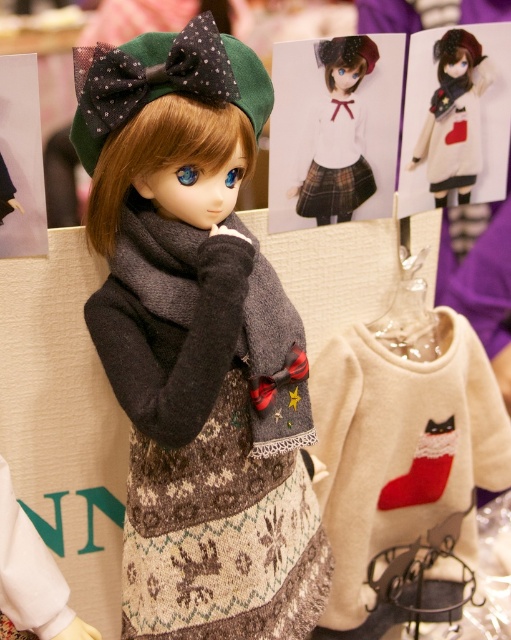
Question: Does matte white sweater at center appear on the right side of matte gray scarf at center?

Choices:
 (A) no
 (B) yes

Answer: (A)

Question: Does dark gray wool scarf at center appear over matte gray scarf at center?

Choices:
 (A) no
 (B) yes

Answer: (A)

Question: Which point is farther from the camera taking this photo?

Choices:
 (A) (365, 449)
 (B) (296, 504)
 (C) (164, 288)
 (D) (466, 170)

Answer: (D)

Question: Does knitted wool sweater at center have a larger size compared to matte gray scarf at center?

Choices:
 (A) no
 (B) yes

Answer: (B)

Question: Which of the following is the closest to the observer?

Choices:
 (A) matte gray scarf at center
 (B) creamy woolen sweater at center
 (C) knitted wool sweater at center

Answer: (C)

Question: Which of the following is the closest to the observer?

Choices:
 (A) knitted wool sweater at center
 (B) red felt stocking at lower right

Answer: (A)